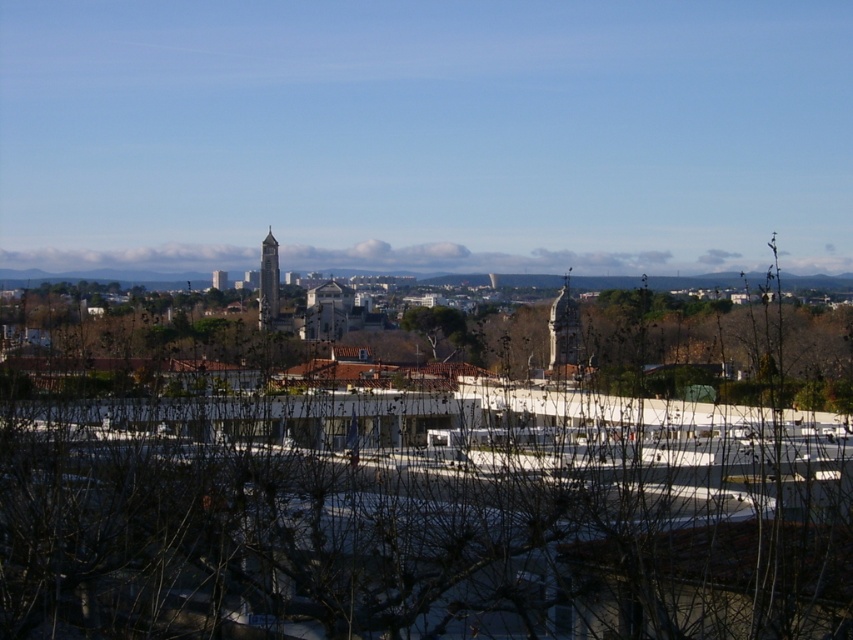
You are standing in the city park and see the smooth stone tower at center and the smooth gray clock tower at center. Which tower is positioned to the right side of the other?

The smooth stone tower at center is positioned to the right of the smooth gray clock tower at center.

In the scene shown: You are standing in the city park and want to take a photo of the brown leafless tree at center and the smooth gray clock tower at center. Which object should you focus on first if you want both to be in the frame without moving the camera?

The brown leafless tree at center is larger than the smooth gray clock tower at center, so you should focus on the brown leafless tree at center first to ensure it fits in the frame before adjusting for the smaller clock tower.

What are the coordinates of the brown leafless tree at center?

The coordinates of the brown leafless tree at center are at point [421,513].